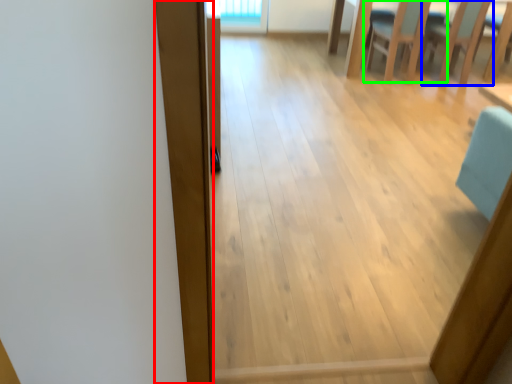
Question: Considering the real-world distances, which object is farthest from plank (highlighted by a red box)? armchair (highlighted by a blue box) or chair (highlighted by a green box)?

Choices:
 (A) armchair
 (B) chair

Answer: (A)